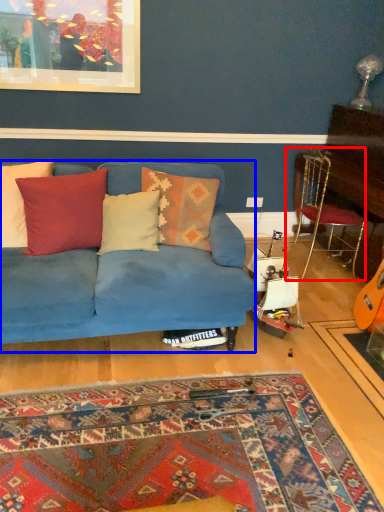
Question: Which of the following is the closest to the observer, chair (highlighted by a red box) or studio couch (highlighted by a blue box)?

Choices:
 (A) chair
 (B) studio couch

Answer: (B)